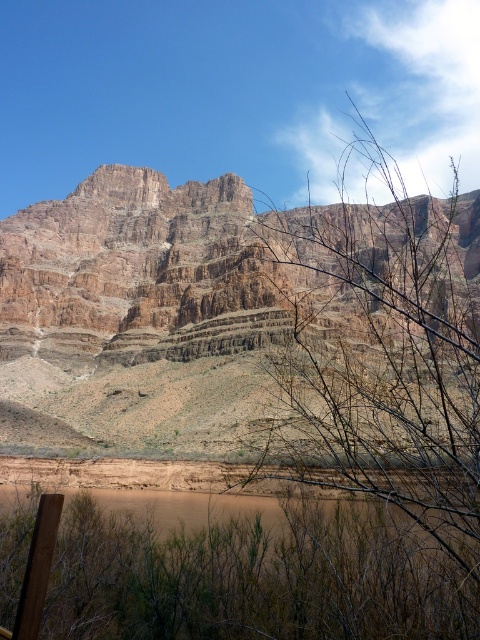
Who is positioned more to the right, brown rocky mountain at upper center or brown matte lake at lower left?

brown matte lake at lower left

Is brown rocky mountain at upper center shorter than brown matte lake at lower left?

No.

Measure the distance between point (260, 289) and camera.

Point (260, 289) is 366.81 feet away from camera.

Locate an element on the screen. The image size is (480, 640). brown rocky mountain at upper center is located at coordinates (164, 310).

Is point (276, 225) less distant than point (348, 273)?

That is False.

Between brown rocky mountain at upper center and brown leafless branches at center, which one appears on the right side from the viewer's perspective?

From the viewer's perspective, brown leafless branches at center appears more on the right side.

Find the location of `brown rocky mountain at upper center`. brown rocky mountain at upper center is located at coordinates (164, 310).

This screenshot has height=640, width=480. What are the coordinates of `brown rocky mountain at upper center` in the screenshot? It's located at (164, 310).

Does brown leafless branches at center have a greater height compared to brown matte lake at lower left?

Correct, brown leafless branches at center is much taller as brown matte lake at lower left.

Can you confirm if brown leafless branches at center is wider than brown matte lake at lower left?

Yes.

Is point (454, 554) farther from camera compared to point (123, 502)?

No, it is not.

Where is `brown leafless branches at center`? Image resolution: width=480 pixels, height=640 pixels. brown leafless branches at center is located at coordinates (387, 392).